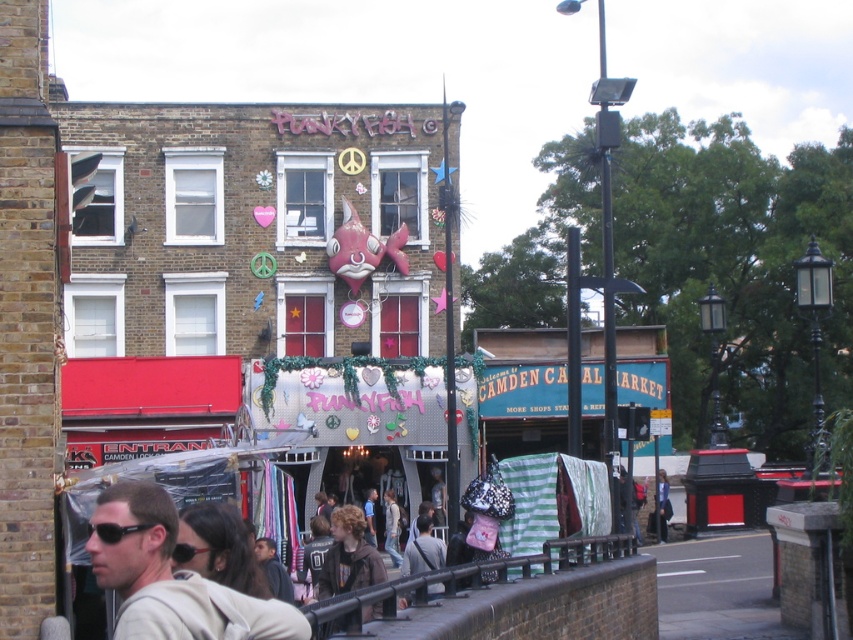
You are a visitor at Camden Market and want to take a photo of the entrance. You notice the black metal railing at lower center and the black plastic goggles at lower left in your viewfinder. Which object will appear larger in your photo?

The black metal railing at lower center will appear larger in your photo because it is much taller than the black plastic goggles at lower left.

You are a customer at Camden Market and want to take a photo of the entrance marked below the fish sculpture. You have a smartphone camera with a 50mm lens. The black metal railing at lower center and the matte gray hoodie at lower left are both in your frame. Which object will appear larger in your photo?

The black metal railing at lower center will appear larger in the photo because it is bigger than the matte gray hoodie at lower left according to the description.